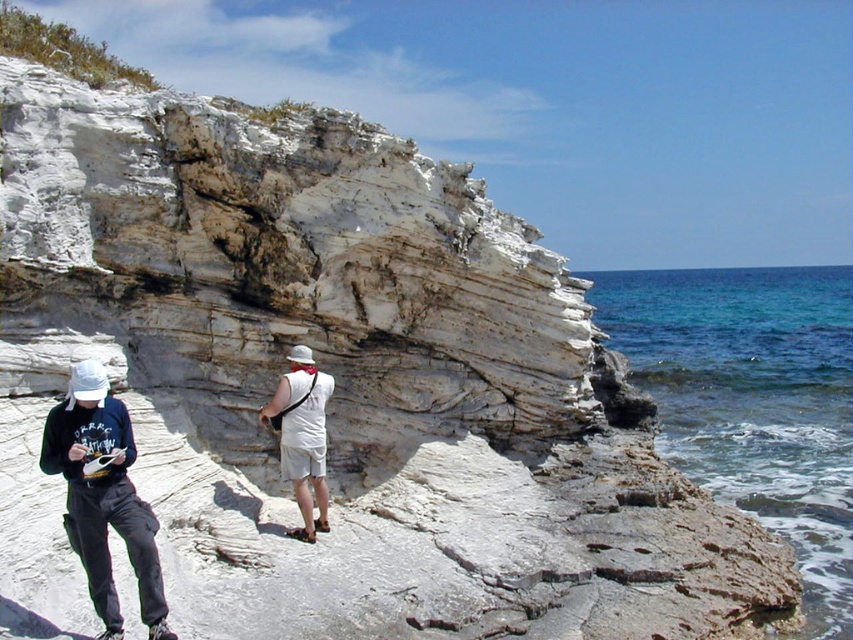
You are standing on the rocky outcrop and want to take a photo of the clear blue water at lower right. Which direction should you face to capture it in your shot?

The clear blue water at lower right is located at point (752, 401), so you should face towards the lower right direction to capture it in your shot.

You are standing on the rocky outcrop and want to take a photo of the clear blue water at lower right and the matte black hoodie at lower left. Which object is positioned higher in your view?

The clear blue water at lower right is located above the matte black hoodie at lower left, so it is positioned higher in your view.

You are a photographer trying to capture the coastal scene with two points marked in the image. The first point is at coordinates point (659, 289) and the second is at point (296, 380). Which point should you focus on first if you want to take a photo that requires focusing on the nearest object first?

Point (296, 380) should be focused on first because it is closer to the camera than point (659, 289) according to the description.